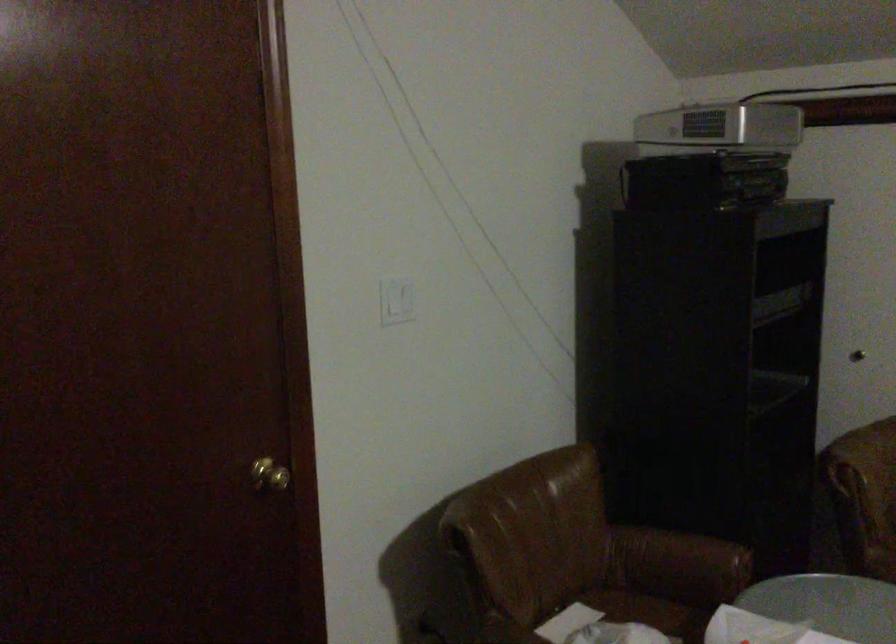
Where is `white light switch`? white light switch is located at coordinates (397, 301).